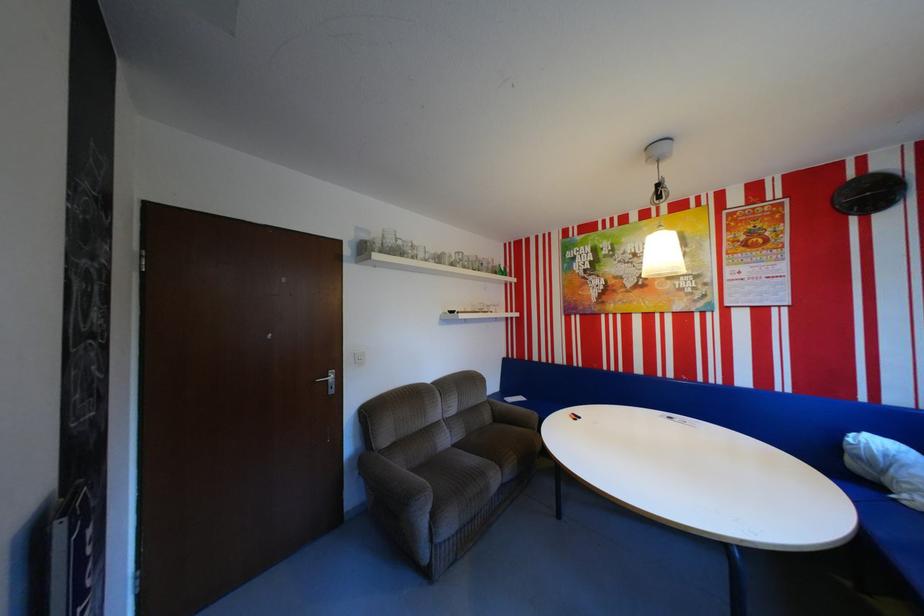
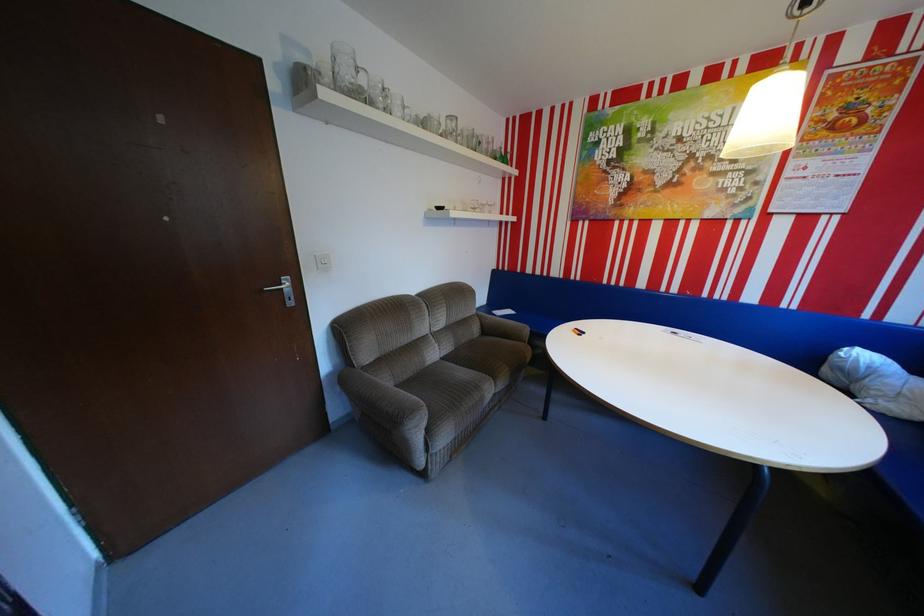
Locate, in the second image, the point that corresponds to the point at 368,471 in the first image.

(349, 386)